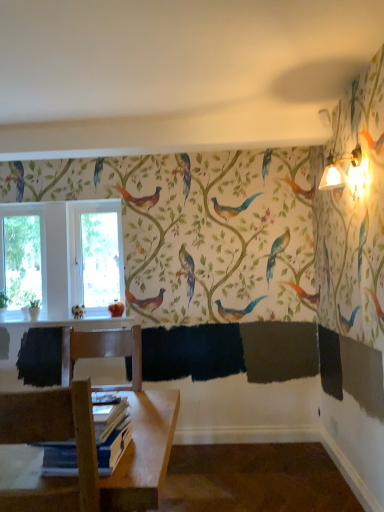
Question: Can you confirm if matte gold sconce at upper right is taller than matte white bird at lower left?

Choices:
 (A) yes
 (B) no

Answer: (A)

Question: Are matte gold sconce at upper right and matte white bird at lower left far apart?

Choices:
 (A) no
 (B) yes

Answer: (B)

Question: From a real-world perspective, is matte gold sconce at upper right on top of matte white bird at lower left?

Choices:
 (A) yes
 (B) no

Answer: (A)

Question: From a real-world perspective, is matte gold sconce at upper right physically below matte white bird at lower left?

Choices:
 (A) no
 (B) yes

Answer: (A)

Question: From the image's perspective, would you say matte gold sconce at upper right is positioned over matte white bird at lower left?

Choices:
 (A) no
 (B) yes

Answer: (B)

Question: Does matte gold sconce at upper right have a lesser width compared to matte white bird at lower left?

Choices:
 (A) no
 (B) yes

Answer: (A)

Question: Can you confirm if transparent glass window at left, positioned as the first window screen in left-to-right order, is shorter than matte white bird at lower left?

Choices:
 (A) yes
 (B) no

Answer: (B)

Question: Does transparent glass window at left, positioned as the first window screen in left-to-right order, have a smaller size compared to matte white bird at lower left?

Choices:
 (A) yes
 (B) no

Answer: (B)

Question: Considering the relative sizes of transparent glass window at left, marked as the 2th window screen in a right-to-left arrangement, and matte white bird at lower left in the image provided, is transparent glass window at left, marked as the 2th window screen in a right-to-left arrangement, taller than matte white bird at lower left?

Choices:
 (A) no
 (B) yes

Answer: (B)

Question: From a real-world perspective, does transparent glass window at left, positioned as the first window screen in left-to-right order, sit lower than matte white bird at lower left?

Choices:
 (A) yes
 (B) no

Answer: (B)

Question: Is transparent glass window at left, positioned as the first window screen in left-to-right order, positioned beyond the bounds of matte white bird at lower left?

Choices:
 (A) yes
 (B) no

Answer: (A)

Question: Does transparent glass window at left, positioned as the first window screen in left-to-right order, lie behind matte white bird at lower left?

Choices:
 (A) no
 (B) yes

Answer: (B)

Question: Is blue paper book at lower left positioned with its back to wooden chair at lower left?

Choices:
 (A) no
 (B) yes

Answer: (B)